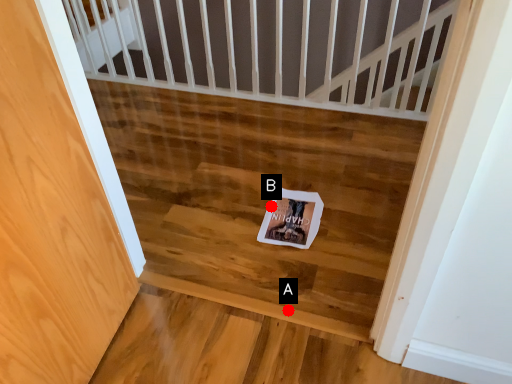
Question: Two points are circled on the image, labeled by A and B beside each circle. Which point is farther to the camera?

Choices:
 (A) A is further
 (B) B is further

Answer: (B)